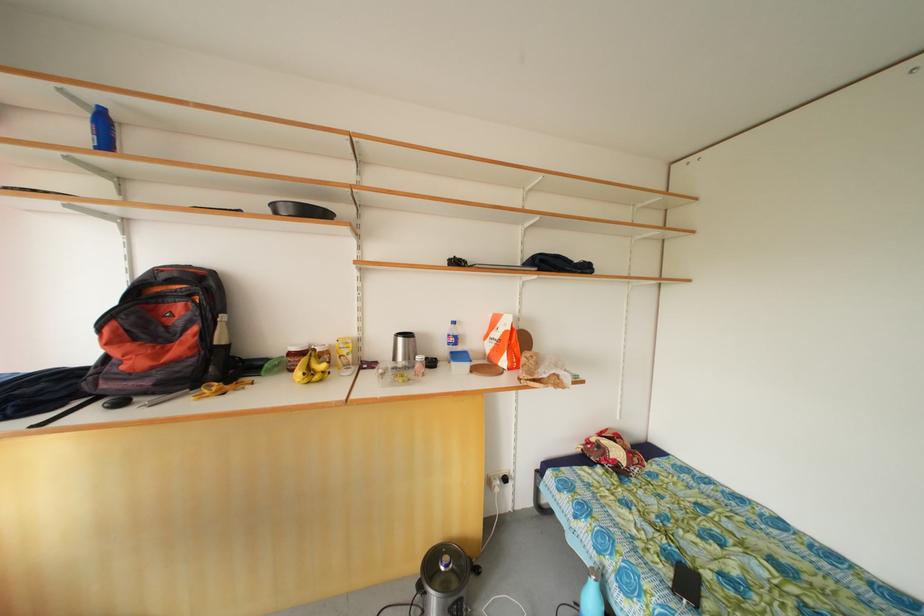
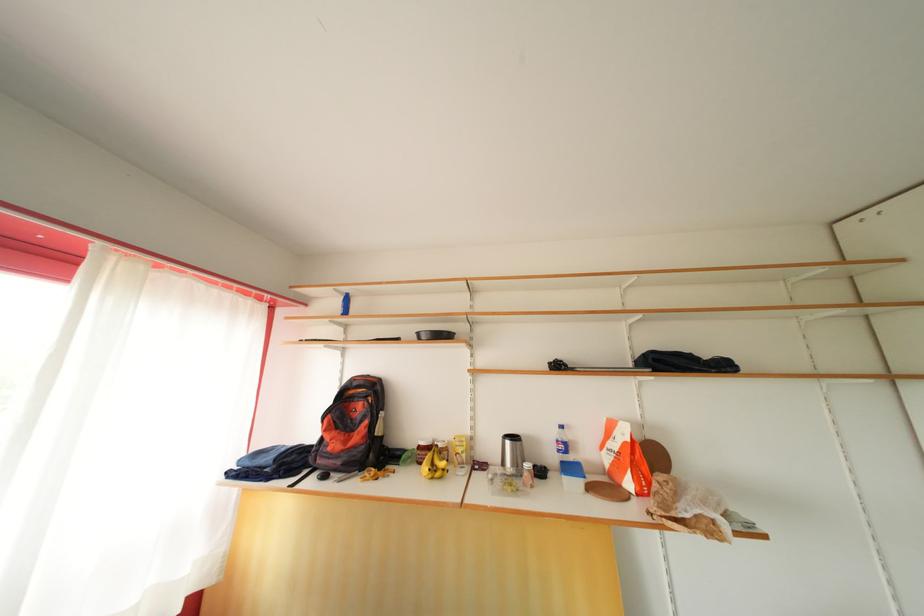
Find the pixel in the second image that matches (473,371) in the first image.

(587, 488)